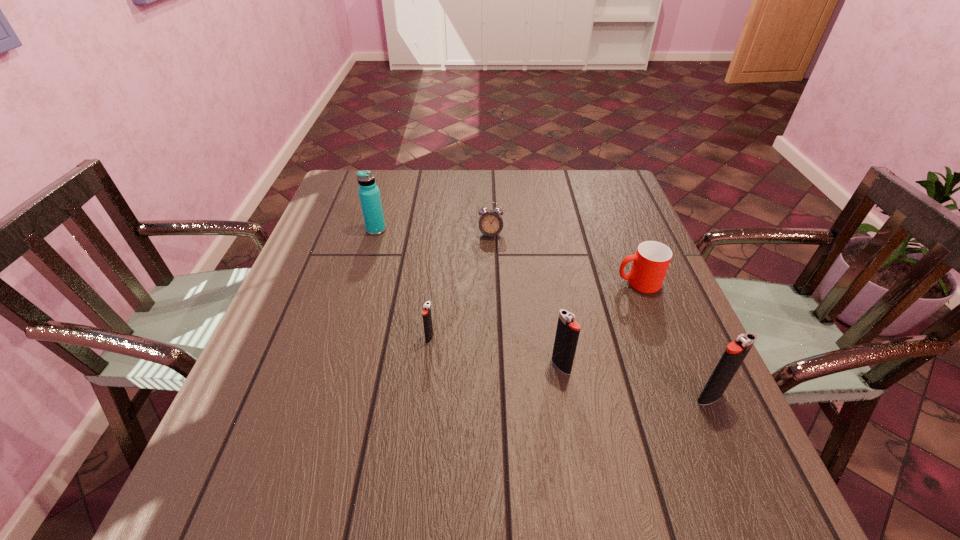
Please point a vacant point for placing a igniter on the left. Please provide its 2D coordinates. Your answer should be formatted as a tuple, i.e. [(x, y)], where the tuple contains the x and y coordinates of a point satisfying the conditions above.

[(312, 313)]